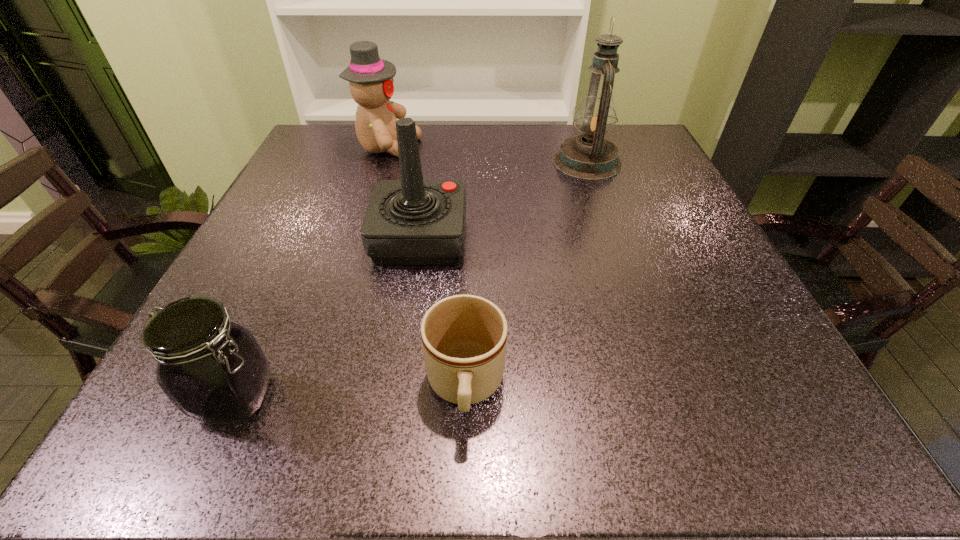
Where is `the tallest object`? The image size is (960, 540). the tallest object is located at coordinates (589, 156).

The width and height of the screenshot is (960, 540). What are the coordinates of `the rightmost object` in the screenshot? It's located at (589, 156).

The image size is (960, 540). Identify the location of rag_doll. (370, 78).

Where is `joystick`? The image size is (960, 540). joystick is located at coordinates (411, 221).

Identify the location of jar. (213, 370).

I want to click on the shortest object, so click(464, 337).

At what (x,y) coordinates should I click in order to perform the action: click on vacant space situated on the left of the oil lamp. Please return your answer as a coordinate pair (x, y). Image resolution: width=960 pixels, height=540 pixels. Looking at the image, I should click on (481, 162).

The width and height of the screenshot is (960, 540). Identify the location of vacant space positioned 0.250m on the front-facing side of the rag_doll. (516, 149).

The width and height of the screenshot is (960, 540). I want to click on vacant region located on the front-facing side of the joystick, so click(570, 238).

Where is `vacant space situated 0.260m on the lid of the jar`? vacant space situated 0.260m on the lid of the jar is located at coordinates (460, 397).